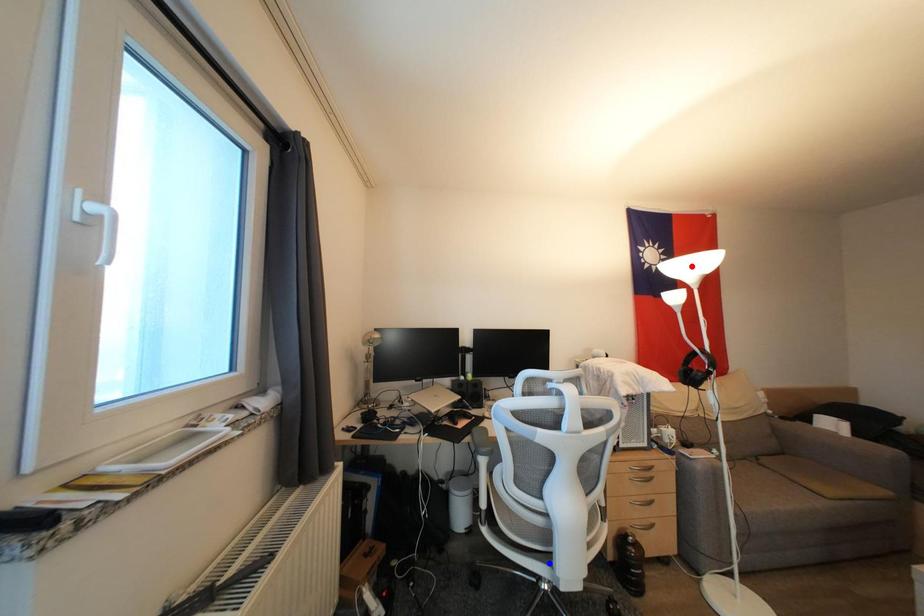
Question: Two points are marked on the image. Which point is closer to the camera?

Choices:
 (A) Blue point is closer.
 (B) Red point is closer.

Answer: (A)